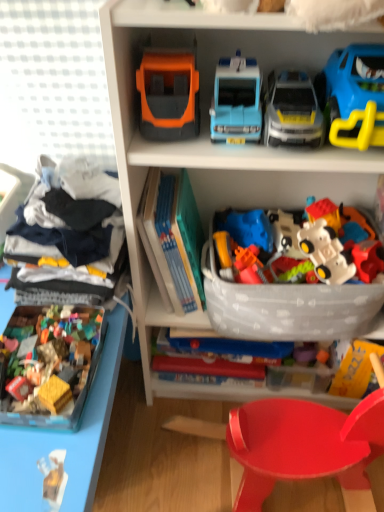
Question: Should I look upward or downward to see hardcover book at center?

Choices:
 (A) up
 (B) down

Answer: (A)

Question: Does orange matte truck at upper center, the 5th toy in the right-to-left sequence, have a lesser height compared to white plastic toy car at center, which ranks as the 5th toy in left-to-right order?

Choices:
 (A) yes
 (B) no

Answer: (A)

Question: Considering the relative sizes of orange matte truck at upper center, the 5th toy in the right-to-left sequence, and white plastic toy car at center, which ranks as the 5th toy in left-to-right order, in the image provided, is orange matte truck at upper center, the 5th toy in the right-to-left sequence, bigger than white plastic toy car at center, which ranks as the 5th toy in left-to-right order,?

Choices:
 (A) yes
 (B) no

Answer: (A)

Question: Can you confirm if orange matte truck at upper center, placed as the second toy when sorted from left to right, is positioned to the right of white plastic toy car at center, which ranks as the 5th toy in left-to-right order?

Choices:
 (A) yes
 (B) no

Answer: (B)

Question: Is orange matte truck at upper center, placed as the second toy when sorted from left to right, further to the viewer compared to white plastic toy car at center, the 2th toy viewed from the right?

Choices:
 (A) no
 (B) yes

Answer: (A)

Question: Is white plastic toy car at center, which ranks as the 5th toy in left-to-right order, completely or partially inside orange matte truck at upper center, the 5th toy in the right-to-left sequence?

Choices:
 (A) yes
 (B) no

Answer: (B)

Question: Does orange matte truck at upper center, the 5th toy in the right-to-left sequence, appear on the left side of white plastic toy car at center, the 2th toy viewed from the right?

Choices:
 (A) yes
 (B) no

Answer: (A)

Question: Is blue plastic car at upper right, the first toy when ordered from right to left, next to white plastic toy car at center, the 2th toy viewed from the right, and touching it?

Choices:
 (A) yes
 (B) no

Answer: (B)

Question: From the image's perspective, is blue plastic car at upper right, arranged as the 6th toy when viewed from the left, on top of white plastic toy car at center, which ranks as the 5th toy in left-to-right order?

Choices:
 (A) yes
 (B) no

Answer: (A)

Question: Is blue plastic car at upper right, arranged as the 6th toy when viewed from the left, facing away from white plastic toy car at center, the 2th toy viewed from the right?

Choices:
 (A) no
 (B) yes

Answer: (A)

Question: Considering the relative sizes of blue plastic car at upper right, the first toy when ordered from right to left, and white plastic toy car at center, the 2th toy viewed from the right, in the image provided, is blue plastic car at upper right, the first toy when ordered from right to left, bigger than white plastic toy car at center, the 2th toy viewed from the right,?

Choices:
 (A) no
 (B) yes

Answer: (B)

Question: Does blue plastic car at upper right, the first toy when ordered from right to left, have a greater height compared to white plastic toy car at center, which ranks as the 5th toy in left-to-right order?

Choices:
 (A) yes
 (B) no

Answer: (B)

Question: Is the depth of blue plastic car at upper right, arranged as the 6th toy when viewed from the left, less than that of white plastic toy car at center, which ranks as the 5th toy in left-to-right order?

Choices:
 (A) yes
 (B) no

Answer: (A)

Question: Is multicolored plastic building blocks at lower left, arranged as the 1th toy when viewed from the left, positioned with its back to light blue plastic toy car at upper center, which ranks as the 4th toy in right-to-left order?

Choices:
 (A) yes
 (B) no

Answer: (B)